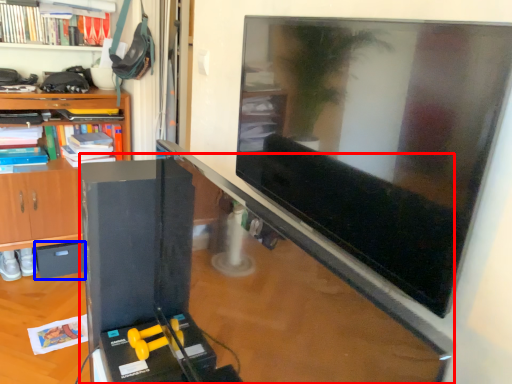
Question: Among these objects, which one is farthest to the camera, computer desk (highlighted by a red box) or drawer (highlighted by a blue box)?

Choices:
 (A) computer desk
 (B) drawer

Answer: (B)